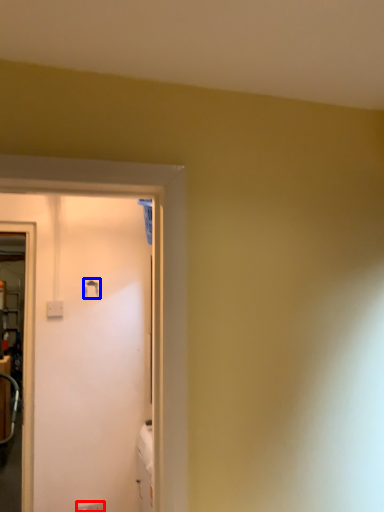
Question: Which object appears closest to the camera in this image, electric outlet (highlighted by a red box) or door handle (highlighted by a blue box)?

Choices:
 (A) electric outlet
 (B) door handle

Answer: (A)